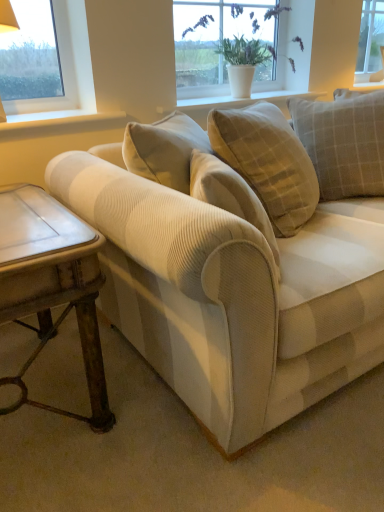
Question: Is rustic wood side table at lower left further to the viewer compared to light beige corduroy pillow at upper right, which is the 1th pillow from right to left?

Choices:
 (A) yes
 (B) no

Answer: (B)

Question: Can you confirm if rustic wood side table at lower left is wider than light beige corduroy pillow at upper right, which is the 1th pillow from right to left?

Choices:
 (A) no
 (B) yes

Answer: (B)

Question: Is rustic wood side table at lower left in front of light beige corduroy pillow at upper right, the 2th pillow viewed from the left?

Choices:
 (A) yes
 (B) no

Answer: (A)

Question: From a real-world perspective, is rustic wood side table at lower left over light beige corduroy pillow at upper right, the 2th pillow viewed from the left?

Choices:
 (A) no
 (B) yes

Answer: (A)

Question: From the image's perspective, is rustic wood side table at lower left over light beige corduroy pillow at upper right, which is the 1th pillow from right to left?

Choices:
 (A) no
 (B) yes

Answer: (A)

Question: Is light beige corduroy pillow at upper right, the 2th pillow viewed from the left, taller or shorter than white textured vase at upper center, positioned as the 2th window sill in front-to-back order?

Choices:
 (A) short
 (B) tall

Answer: (B)

Question: Considering the positions of light beige corduroy pillow at upper right, which is the 1th pillow from right to left, and white textured vase at upper center, positioned as the 2th window sill in front-to-back order, in the image, is light beige corduroy pillow at upper right, which is the 1th pillow from right to left, wider or thinner than white textured vase at upper center, positioned as the 2th window sill in front-to-back order,?

Choices:
 (A) wide
 (B) thin

Answer: (A)

Question: Choose the correct answer: Is light beige corduroy pillow at upper right, which is the 1th pillow from right to left, inside white textured vase at upper center, the second window sill positioned from the left, or outside it?

Choices:
 (A) inside
 (B) outside

Answer: (B)

Question: Relative to white textured vase at upper center, positioned as the 2th window sill in front-to-back order, is light beige corduroy pillow at upper right, which is the 1th pillow from right to left, in front or behind?

Choices:
 (A) behind
 (B) front

Answer: (B)

Question: Does point (309, 94) appear closer or farther from the camera than point (221, 82)?

Choices:
 (A) closer
 (B) farther

Answer: (B)

Question: Considering their positions, is white textured vase at upper center, the second window sill positioned from the left, located in front of or behind white ceramic pot at upper center, the first window from the front?

Choices:
 (A) behind
 (B) front

Answer: (B)

Question: From a real-world perspective, relative to white ceramic pot at upper center, the 1th window when ordered from left to right, is white textured vase at upper center, the second window sill positioned from the left, vertically above or below?

Choices:
 (A) below
 (B) above

Answer: (A)

Question: Looking at their shapes, would you say white textured vase at upper center, which is the second window sill from bottom to top, is wider or thinner than white ceramic pot at upper center, which is counted as the 2th window, starting from the back?

Choices:
 (A) wide
 (B) thin

Answer: (A)

Question: Visually, is rustic wood side table at lower left positioned to the left or to the right of beige corduroy couch at center?

Choices:
 (A) right
 (B) left

Answer: (B)

Question: Looking at their shapes, would you say rustic wood side table at lower left is wider or thinner than beige corduroy couch at center?

Choices:
 (A) thin
 (B) wide

Answer: (A)